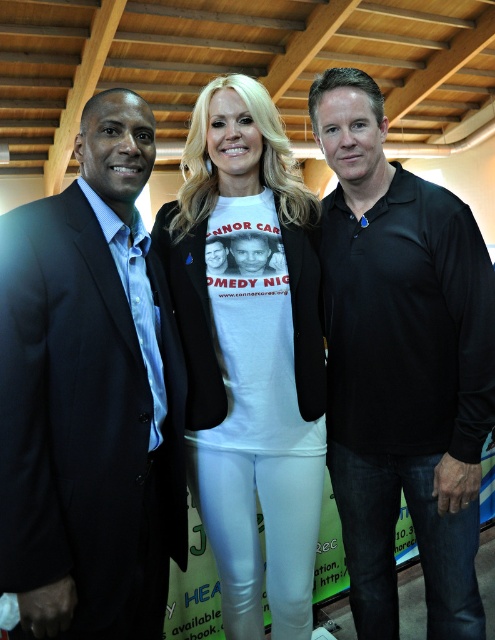
You are organizing a photo shoot and need to arrange the models in a line from left to right based on their clothing. The models are wearing the matte black suit at left and the black smooth polo shirt at right. Which clothing item should be placed first on the left side of the line?

The matte black suit at left should be placed first on the left side of the line because it is already positioned to the left of the black smooth polo shirt at right in the original image.

You are a photographer setting up for a group photo. You need to position yourself between the matte black suit at left and the black smooth polo shirt at right. Given that your camera has a maximum focus range of 25 inches, will you be able to capture both individuals clearly in the same frame without adjusting your position?

The distance between the matte black suit at left and the black smooth polo shirt at right is 24.66 inches, which is within the camera maximum focus range of 25 inches. Therefore, you can capture both individuals clearly in the same frame without moving.